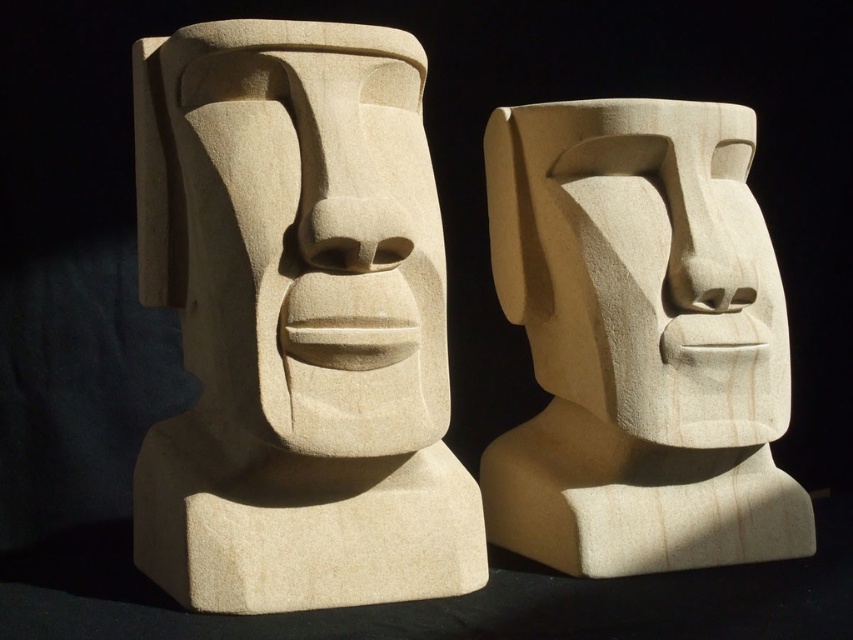
Question: Observing the image, what is the correct spatial positioning of smooth beige stone moai head at center in reference to smooth beige stone head at center?

Choices:
 (A) below
 (B) above

Answer: (B)

Question: Can you confirm if smooth beige stone moai head at center is bigger than smooth beige stone head at center?

Choices:
 (A) yes
 (B) no

Answer: (A)

Question: Among these objects, which one is nearest to the camera?

Choices:
 (A) smooth beige stone moai head at center
 (B) smooth beige stone head at center

Answer: (A)

Question: Which of the following is the closest to the observer?

Choices:
 (A) smooth beige stone head at center
 (B) smooth beige stone moai head at center

Answer: (B)

Question: Is smooth beige stone moai head at center smaller than smooth beige stone head at center?

Choices:
 (A) no
 (B) yes

Answer: (A)